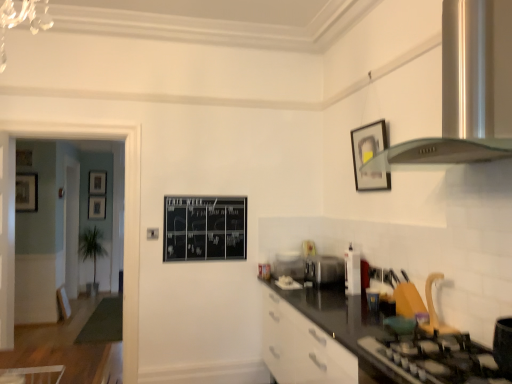
Locate an element on the screen. The height and width of the screenshot is (384, 512). blank space situated above black chalkboard at center (from a real-world perspective) is located at coordinates (206, 190).